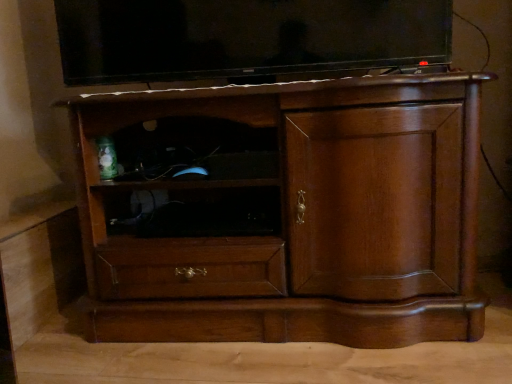
Question: From a real-world perspective, relative to matte black tv at upper center, is brown wood cabinet at center vertically above or below?

Choices:
 (A) below
 (B) above

Answer: (A)

Question: Is point pyautogui.click(x=117, y=110) positioned closer to the camera than point pyautogui.click(x=100, y=16)?

Choices:
 (A) closer
 (B) farther

Answer: (A)

Question: Estimate the real-world distances between objects in this image. Which object is farther from the brown wood cabinet at center?

Choices:
 (A) matte black tv at upper center
 (B) black matte shelf at center

Answer: (A)

Question: Based on their relative distances, which object is farther from the matte black tv at upper center?

Choices:
 (A) black matte shelf at center
 (B) brown wood cabinet at center

Answer: (A)